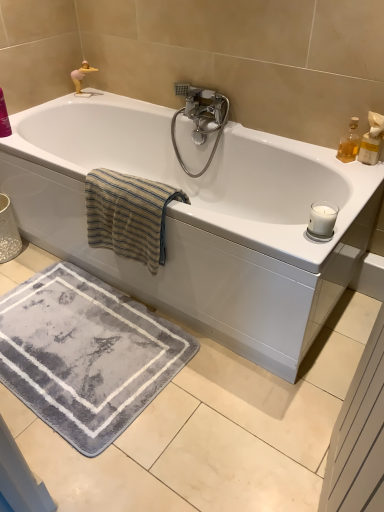
Identify the location of vacant space positioned to the left of translucent glass bottle at upper right. [329, 159].